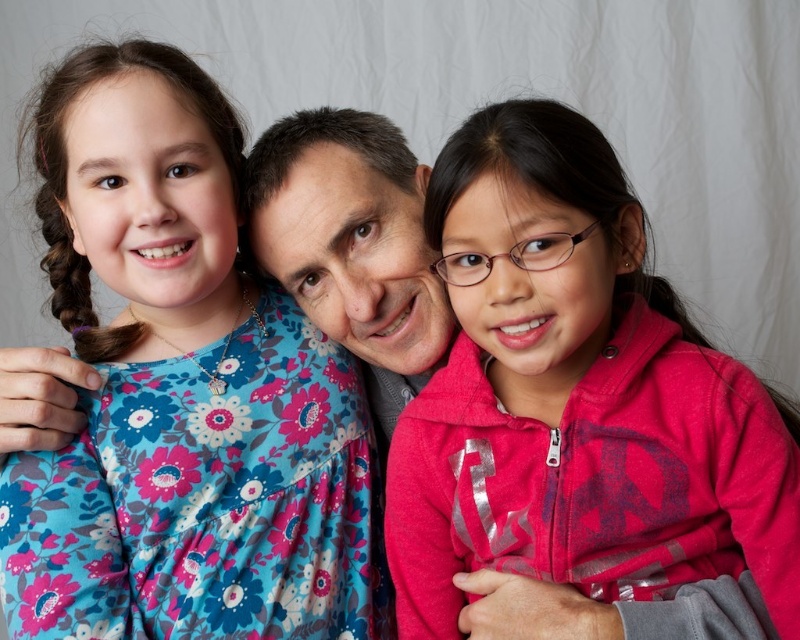
You are observing the scene and need to determine the position of the floral fabric dress at upper left relative to the adult male. Based on the coordinates provided, is the dress to the left or right of the adult male?

The floral fabric dress at upper left is located at point (182,392), which places it to the right of the adult male.

You are a fashion designer observing the image. You need to determine which item of clothing is more suitable for a slim figure. Which one would you recommend between the floral fabric dress at upper left and the pink fleece jacket at center?

The floral fabric dress at upper left is thinner than the pink fleece jacket at center, so it would be more suitable for a slim figure.